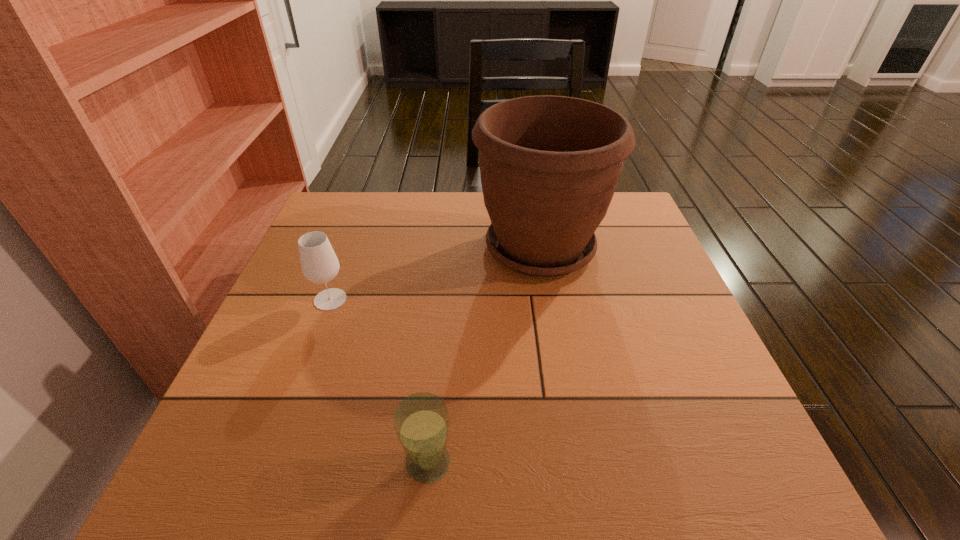
The width and height of the screenshot is (960, 540). I want to click on vacant region that satisfies the following two spatial constraints: 1. on the front side of the nearest object; 2. on the left side of the second tallest object, so click(x=270, y=462).

Locate an element on the screen. Image resolution: width=960 pixels, height=540 pixels. free point that satisfies the following two spatial constraints: 1. on the front side of the shorter glass; 2. on the left side of the second tallest object is located at coordinates (270, 462).